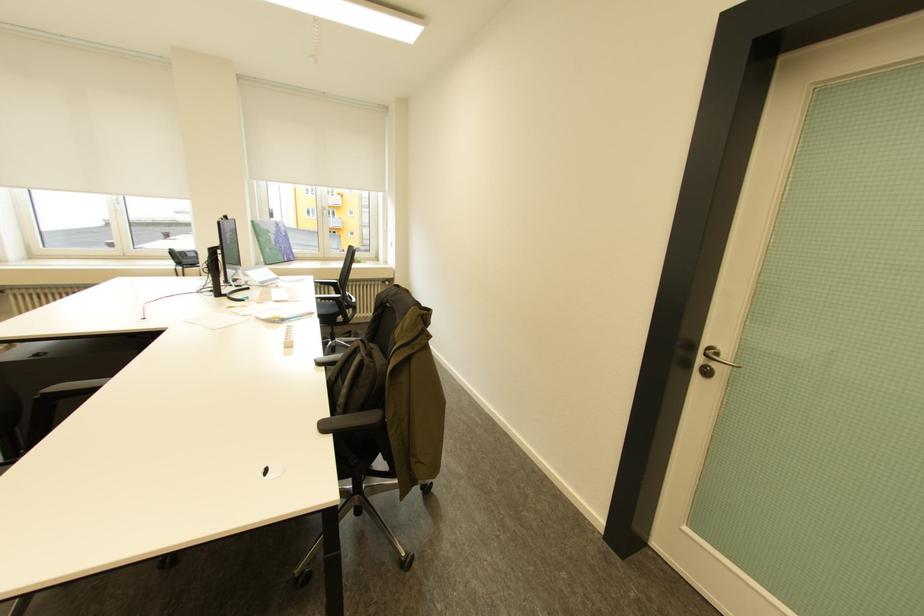
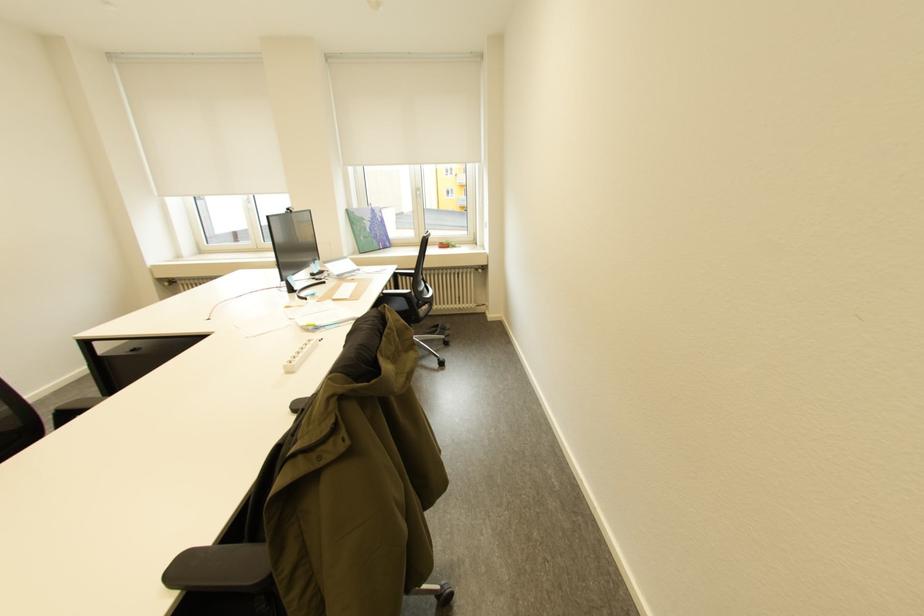
In a continuous first-person perspective shot, in which direction is the camera moving?

The cameraman moved toward right, forward.